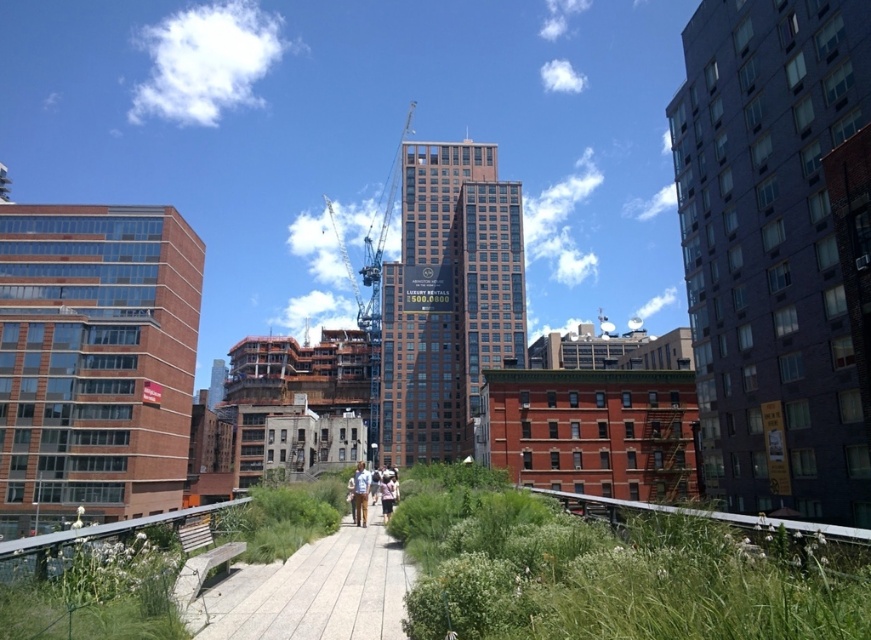
You are a photographer standing at the end of the pathway. You want to take a photo that includes both the wooden at center and the light brown leather jacket at center. Which object should you focus on first if you want to ensure both are in frame?

The wooden at center is not as tall as the light brown leather jacket at center, so you should focus on the light brown leather jacket at center first to ensure both are in frame.

Looking at this image, you are standing at the edge of the pathway and want to place a small bench exactly at the center of the wooden at center. What are the coordinates where you should place it?

The coordinates for the center of the wooden at center are approximately 0.923 in the x axis and 0.365 in the y axis.

You are standing on the pathway and want to place a 1.5 meter wide object between the wooden at center and the matte white shirt at center. Can the space between them accommodate this object?

The wooden at center has a lesser width compared to matte white shirt at center. The space between them may not be sufficient to accommodate a 1.5 meter wide object since the wooden at center is narrower, but the exact distance isn not provided in the description.